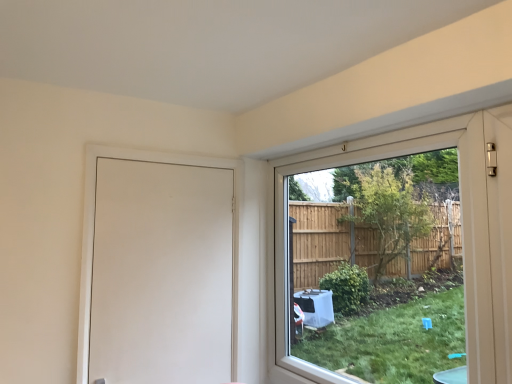
Describe the element at coordinates (462, 228) in the screenshot. I see `clear glass window at right` at that location.

The image size is (512, 384). Find the location of `clear glass window at right`. clear glass window at right is located at coordinates (462, 228).

This screenshot has height=384, width=512. Describe the element at coordinates (161, 273) in the screenshot. I see `white matte door at left` at that location.

At what (x,y) coordinates should I click in order to perform the action: click on white matte door at left. Please return your answer as a coordinate pair (x, y). The image size is (512, 384). Looking at the image, I should click on (161, 273).

In order to click on clear glass window at right in this screenshot , I will do `click(462, 228)`.

Between clear glass window at right and white matte door at left, which one appears on the left side from the viewer's perspective?

From the viewer's perspective, white matte door at left appears more on the left side.

Does clear glass window at right lie in front of white matte door at left?

Yes, clear glass window at right is closer to the viewer.

Between point (284, 360) and point (213, 348), which one is positioned in front?

The point (213, 348) is in front.

From the image's perspective, is clear glass window at right below white matte door at left?

No, from the image's perspective, clear glass window at right is not beneath white matte door at left.

From a real-world perspective, is clear glass window at right above or below white matte door at left?

In terms of real-world spatial position, clear glass window at right is above white matte door at left.

Considering the sizes of objects clear glass window at right and white matte door at left in the image provided, who is thinner, clear glass window at right or white matte door at left?

With smaller width is white matte door at left.

Between clear glass window at right and white matte door at left, which one has less height?

white matte door at left is shorter.

Can you confirm if clear glass window at right is smaller than white matte door at left?

No, clear glass window at right is not smaller than white matte door at left.

Would you say clear glass window at right is inside or outside white matte door at left?

clear glass window at right lies outside white matte door at left.

In the scene shown: Are clear glass window at right and white matte door at left located far from each other?

No, clear glass window at right is in close proximity to white matte door at left.

Is clear glass window at right looking in the opposite direction of white matte door at left?

No, clear glass window at right is not facing away from white matte door at left.

What's the angular difference between clear glass window at right and white matte door at left's facing directions?

The angle between the facing direction of clear glass window at right and the facing direction of white matte door at left is 89.4 degrees.

This screenshot has height=384, width=512. I want to click on door below the clear glass window at right (from the image's perspective), so click(161, 273).

Which is more to the left, white matte door at left or clear glass window at right?

white matte door at left.

Is white matte door at left in front of clear glass window at right?

No, white matte door at left is behind clear glass window at right.

Is point (176, 377) farther from viewer compared to point (473, 197)?

Yes, point (176, 377) is behind point (473, 197).

From the image's perspective, is white matte door at left above clear glass window at right?

Actually, white matte door at left appears below clear glass window at right in the image.

From a real-world perspective, who is located higher, white matte door at left or clear glass window at right?

clear glass window at right is physically above.

Can you confirm if white matte door at left is thinner than clear glass window at right?

Correct, the width of white matte door at left is less than that of clear glass window at right.

Does white matte door at left have a lesser height compared to clear glass window at right?

Yes, white matte door at left is shorter than clear glass window at right.

From the picture: Does white matte door at left have a smaller size compared to clear glass window at right?

Indeed, white matte door at left has a smaller size compared to clear glass window at right.

Is clear glass window at right completely or partially inside white matte door at left?

Actually, clear glass window at right is outside white matte door at left.

Is white matte door at left in contact with clear glass window at right?

white matte door at left is not next to clear glass window at right, and they're not touching.

Is clear glass window at right at the back of white matte door at left?

No.

How different are the orientations of white matte door at left and clear glass window at right in degrees?

The facing directions of white matte door at left and clear glass window at right are 89.4 degrees apart.

Find the location of `window that is on the right side of white matte door at left`. window that is on the right side of white matte door at left is located at coordinates (462, 228).

The height and width of the screenshot is (384, 512). I want to click on door behind the clear glass window at right, so click(x=161, y=273).

Identify the location of door below the clear glass window at right (from a real-world perspective). (161, 273).